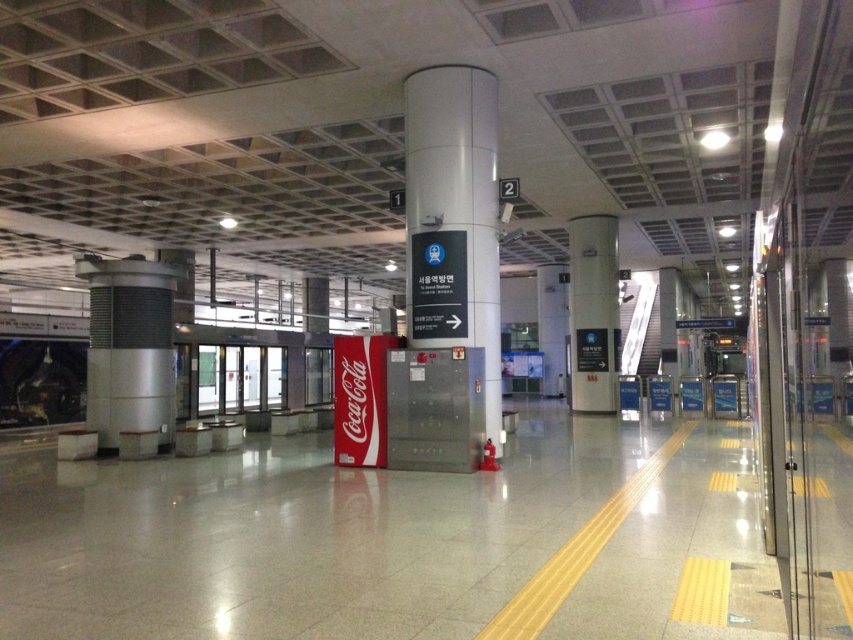
Question: Is satin silver signpost at center thinner than silver metallic pillar at left?

Choices:
 (A) no
 (B) yes

Answer: (B)

Question: Does satin silver signpost at center have a lesser width compared to silver metallic pillar at left?

Choices:
 (A) no
 (B) yes

Answer: (B)

Question: Can you confirm if satin silver signpost at center is positioned to the right of white glossy pillar at center?

Choices:
 (A) no
 (B) yes

Answer: (A)

Question: Based on their relative distances, which object is farther from the satin silver signpost at center?

Choices:
 (A) white glossy pillar at center
 (B) silver metallic pillar at left

Answer: (A)

Question: Among these objects, which one is farthest from the camera?

Choices:
 (A) satin silver signpost at center
 (B) white glossy pillar at center
 (C) silver metallic pillar at left

Answer: (B)

Question: Which of the following is the farthest from the observer?

Choices:
 (A) (460, 161)
 (B) (115, 337)

Answer: (B)